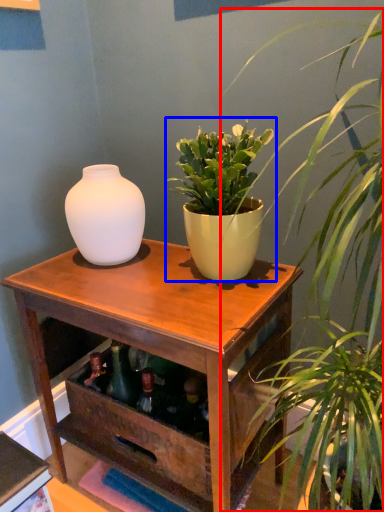
Question: Which object appears farthest to the camera in this image, houseplant (highlighted by a red box) or houseplant (highlighted by a blue box)?

Choices:
 (A) houseplant
 (B) houseplant

Answer: (B)